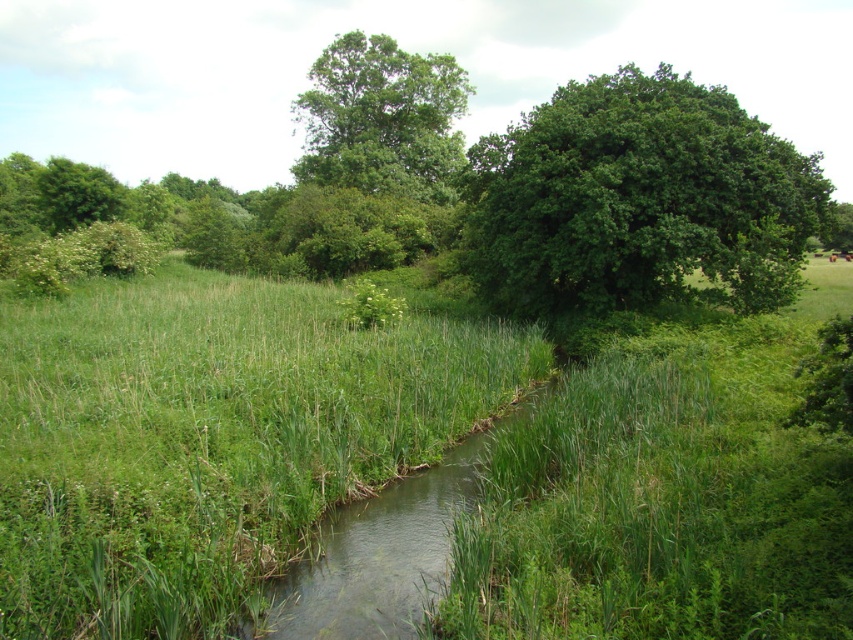
Question: Is green grassy at center positioned in front of green leafy tree at upper right?

Choices:
 (A) no
 (B) yes

Answer: (B)

Question: Can you confirm if green leafy tree at upper right is wider than green leafy tree at upper center?

Choices:
 (A) no
 (B) yes

Answer: (B)

Question: Does green grassy at center come behind green leafy tree at upper center?

Choices:
 (A) no
 (B) yes

Answer: (A)

Question: Which point is farther from the camera taking this photo?

Choices:
 (A) (843, 474)
 (B) (347, 141)

Answer: (B)

Question: Which object is closer to the camera taking this photo?

Choices:
 (A) green leafy tree at upper right
 (B) green leafy tree at upper center

Answer: (A)

Question: Which object is positioned farthest from the green grassy at center?

Choices:
 (A) green leafy tree at upper right
 (B) green leafy tree at upper center

Answer: (B)